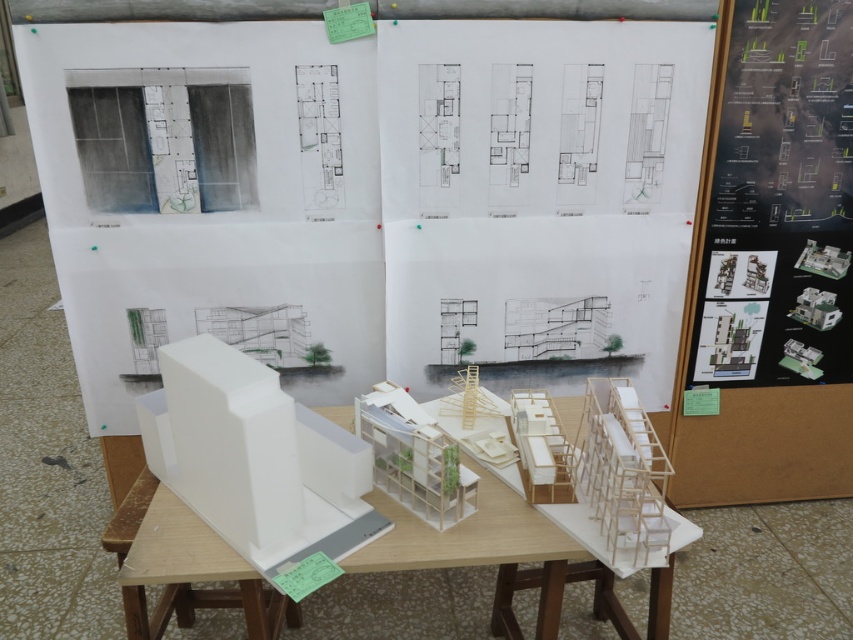
Between black matte poster at upper right and white matte building at left, which one has less height?

With less height is white matte building at left.

Consider the image. Is black matte poster at upper right below white matte building at left?

Actually, black matte poster at upper right is above white matte building at left.

Identify the location of black matte poster at upper right. (779, 202).

Who is higher up, white matte building at left or white matte model building at center?

white matte building at left

Who is positioned more to the left, white matte building at left or white matte model building at center?

From the viewer's perspective, white matte building at left appears more on the left side.

Who is more distant from viewer, (289, 403) or (407, 525)?

The point (407, 525) is behind.

Where is `white matte building at left`? white matte building at left is located at coordinates (254, 460).

What do you see at coordinates (779, 202) in the screenshot? I see `black matte poster at upper right` at bounding box center [779, 202].

This screenshot has width=853, height=640. In order to click on black matte poster at upper right in this screenshot , I will do `click(779, 202)`.